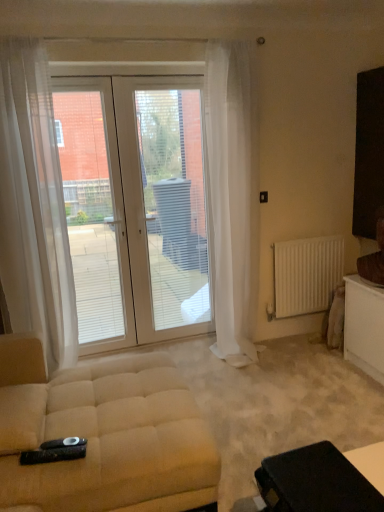
Question: From the image's perspective, is white sheer curtain at center, the second curtain viewed from the left, above or below white glass door at center?

Choices:
 (A) below
 (B) above

Answer: (B)

Question: Is white sheer curtain at center, the second curtain viewed from the left, to the left or to the right of white glass door at center in the image?

Choices:
 (A) right
 (B) left

Answer: (A)

Question: Estimate the real-world distances between objects in this image. Which object is closer to the white sheer curtain at left, positioned as the second curtain in right-to-left order?

Choices:
 (A) white glass door at center
 (B) white glass door at center
 (C) beige fabric studio couch at lower left
 (D) white sheer curtain at center, which appears as the 1th curtain when viewed from the right
 (E) black leather table at lower right

Answer: (A)

Question: Which object is the closest to the white sheer curtain at center, the second curtain viewed from the left?

Choices:
 (A) white glass door at center
 (B) white matte radiator at right
 (C) white glass door at center
 (D) black leather table at lower right
 (E) white sheer curtain at left, which ranks as the first curtain in left-to-right order

Answer: (A)